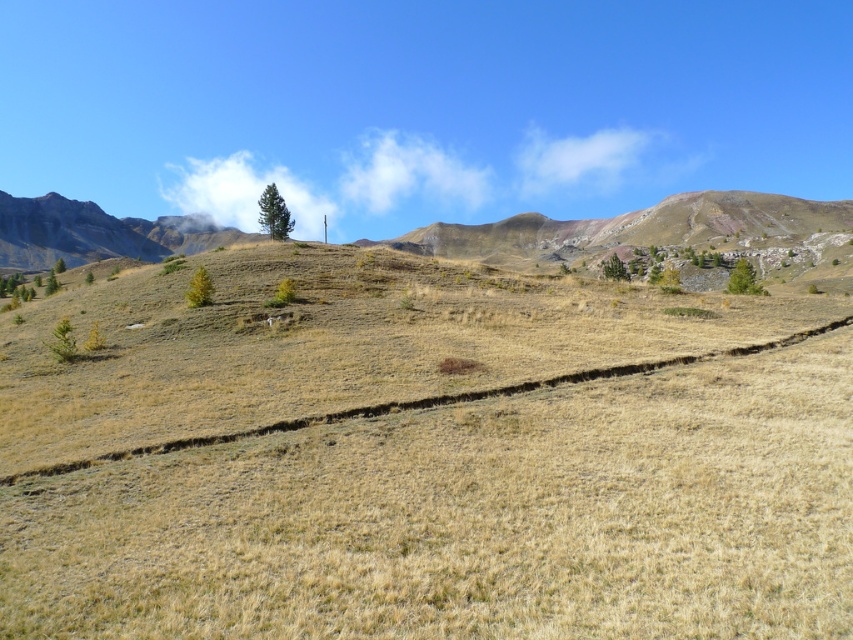
You are standing in the open landscape and want to walk towards the rustic brown mountain at center. Which direction should you head relative to the green matte tree at center?

To reach the rustic brown mountain at center, you should head to the right relative to the green matte tree at center since the rustic brown mountain at center is positioned to the right of the green matte tree at center.